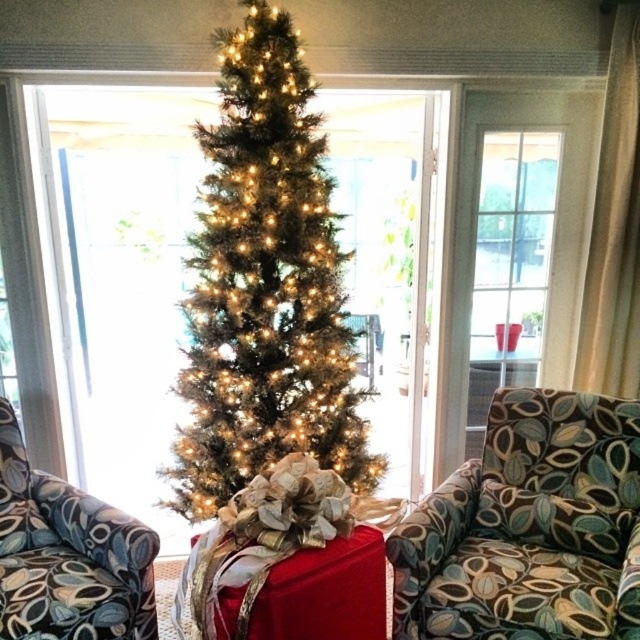
Which is below, green textured christmas tree at center or patterned fabric armchair at left?

patterned fabric armchair at left is lower down.

Does point (328, 449) come closer to viewer compared to point (74, 529)?

No, (328, 449) is behind (74, 529).

Image resolution: width=640 pixels, height=640 pixels. What do you see at coordinates (264, 285) in the screenshot?
I see `green textured christmas tree at center` at bounding box center [264, 285].

This screenshot has width=640, height=640. In order to click on green textured christmas tree at center in this screenshot , I will do click(264, 285).

Between green textured christmas tree at center and patterned fabric armchair at center, which one appears on the right side from the viewer's perspective?

patterned fabric armchair at center

Is green textured christmas tree at center smaller than patterned fabric armchair at center?

No, green textured christmas tree at center is not smaller than patterned fabric armchair at center.

Find the location of a particular element. green textured christmas tree at center is located at coordinates (264, 285).

Is patterned fabric armchair at center to the right of patterned fabric armchair at left from the viewer's perspective?

Indeed, patterned fabric armchair at center is positioned on the right side of patterned fabric armchair at left.

Is patterned fabric armchair at center shorter than patterned fabric armchair at left?

No, patterned fabric armchair at center is not shorter than patterned fabric armchair at left.

Who is more forward, (493, 445) or (58, 513)?

Point (58, 513)

Where is `patterned fabric armchair at center`? This screenshot has height=640, width=640. patterned fabric armchair at center is located at coordinates (529, 529).